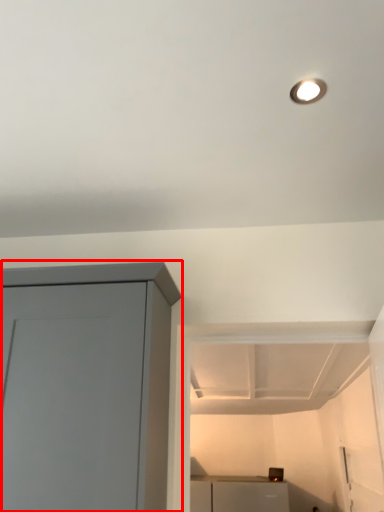
Question: In this image, where is cupboard (annotated by the red box) located relative to appliance?

Choices:
 (A) left
 (B) right

Answer: (A)